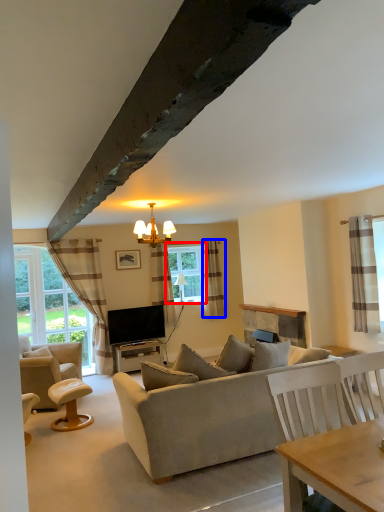
Question: Which point is closer to the camera, window (highlighted by a red box) or curtain (highlighted by a blue box)?

Choices:
 (A) window
 (B) curtain

Answer: (B)